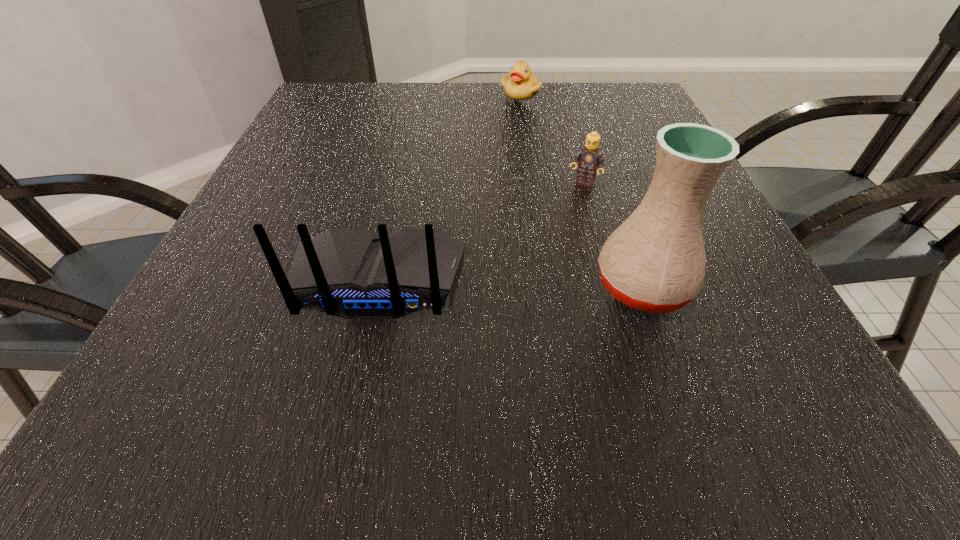
Locate an element on the screen. The width and height of the screenshot is (960, 540). vacant position in the image that satisfies the following two spatial constraints: 1. on the front side of the second shortest object; 2. on the left side of the shortest object is located at coordinates (534, 183).

Identify the location of free space that satisfies the following two spatial constraints: 1. on the back of the tallest object; 2. on the right side of the third shortest object. The image size is (960, 540). (378, 286).

At what (x,y) coordinates should I click in order to perform the action: click on free space that satisfies the following two spatial constraints: 1. on the back of the tallest object; 2. on the right side of the second tallest object. Please return your answer as a coordinate pair (x, y). This screenshot has height=540, width=960. Looking at the image, I should click on [x=378, y=286].